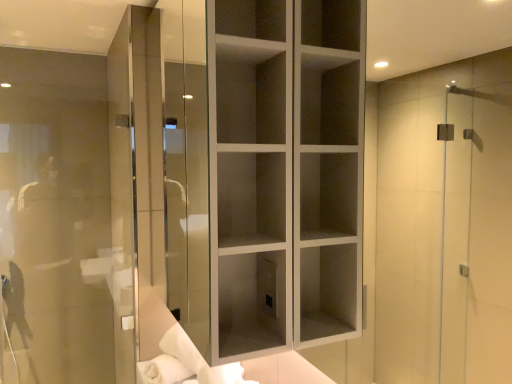
Locate an element on the screen. The image size is (512, 384). white matte cabinet at center is located at coordinates (285, 172).

Measure the distance between white matte cabinet at center and camera.

white matte cabinet at center and camera are 38.74 inches apart from each other.

What do you see at coordinates (285, 172) in the screenshot?
I see `white matte cabinet at center` at bounding box center [285, 172].

At what (x,y) coordinates should I click in order to perform the action: click on white matte cabinet at center. Please return your answer as a coordinate pair (x, y). This screenshot has width=512, height=384. Looking at the image, I should click on (285, 172).